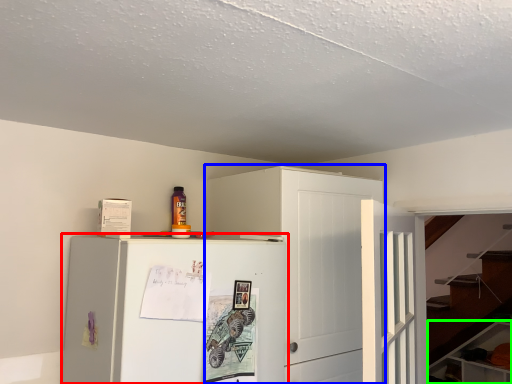
Question: Considering the real-world distances, which object is farthest from refrigerator (highlighted by a red box)? cabinetry (highlighted by a blue box) or cabinetry (highlighted by a green box)?

Choices:
 (A) cabinetry
 (B) cabinetry

Answer: (B)